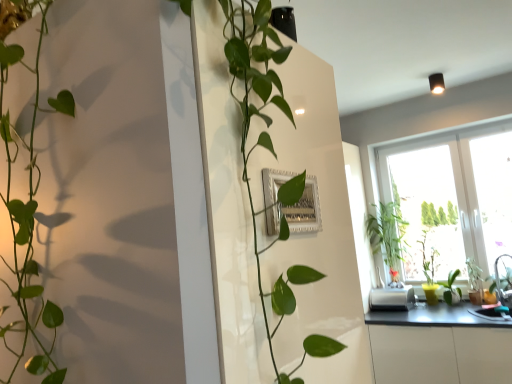
Question: Is white plastic toaster at lower right far away from green glossy plant at left, which is the 2th houseplant from right to left?

Choices:
 (A) yes
 (B) no

Answer: (A)

Question: From a real-world perspective, is white plastic toaster at lower right physically below green glossy plant at left, which is the 2th houseplant from right to left?

Choices:
 (A) yes
 (B) no

Answer: (A)

Question: Is white plastic toaster at lower right closer to camera compared to green glossy plant at left, which ranks as the 1th houseplant in left-to-right order?

Choices:
 (A) no
 (B) yes

Answer: (A)

Question: Considering the relative positions of white plastic toaster at lower right and green glossy plant at left, the first houseplant from the front, in the image provided, is white plastic toaster at lower right to the right of green glossy plant at left, the first houseplant from the front, from the viewer's perspective?

Choices:
 (A) no
 (B) yes

Answer: (B)

Question: Considering the relative sizes of white plastic toaster at lower right and green glossy plant at left, which is the 2th houseplant from right to left, in the image provided, is white plastic toaster at lower right taller than green glossy plant at left, which is the 2th houseplant from right to left,?

Choices:
 (A) no
 (B) yes

Answer: (A)

Question: Looking at the image, does transparent glass window at right seem bigger or smaller compared to green glossy plant at right, the 2th plant viewed from the right?

Choices:
 (A) big
 (B) small

Answer: (A)

Question: In terms of height, does transparent glass window at right look taller or shorter compared to green glossy plant at right, the 1th plant viewed from the left?

Choices:
 (A) tall
 (B) short

Answer: (A)

Question: Is point (484, 185) positioned closer to the camera than point (453, 279)?

Choices:
 (A) farther
 (B) closer

Answer: (B)

Question: In terms of width, does transparent glass window at right look wider or thinner when compared to green glossy plant at right, the 2th plant viewed from the right?

Choices:
 (A) wide
 (B) thin

Answer: (A)

Question: Considering their positions, is green glossy plant at right, the second houseplant viewed from the left, located in front of or behind white plastic toaster at lower right?

Choices:
 (A) behind
 (B) front

Answer: (A)

Question: Looking at their shapes, would you say green glossy plant at right, the 1th houseplant in the back-to-front sequence, is wider or thinner than white plastic toaster at lower right?

Choices:
 (A) wide
 (B) thin

Answer: (B)

Question: Is point [x=372, y=226] positioned closer to the camera than point [x=398, y=309]?

Choices:
 (A) closer
 (B) farther

Answer: (B)

Question: Is green glossy plant at right, the second houseplant viewed from the left, inside the boundaries of white plastic toaster at lower right, or outside?

Choices:
 (A) outside
 (B) inside

Answer: (A)

Question: Choose the correct answer: Is metallic gray countertop at lower right inside green glossy plant at left, which ranks as the 1th houseplant in left-to-right order, or outside it?

Choices:
 (A) outside
 (B) inside

Answer: (A)

Question: From the image's perspective, relative to green glossy plant at left, the first houseplant from the front, is metallic gray countertop at lower right above or below?

Choices:
 (A) below
 (B) above

Answer: (A)